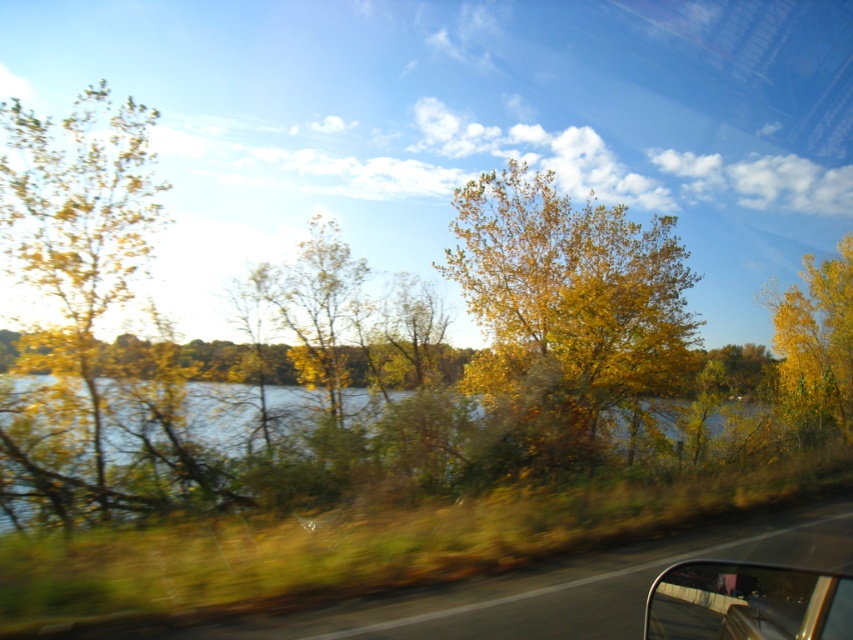
Between yellow/golden leaves at center and transparent glass car window at lower right, which one has more height?

yellow/golden leaves at center

Is yellow/golden leaves at center bigger than transparent glass car window at lower right?

Indeed, yellow/golden leaves at center has a larger size compared to transparent glass car window at lower right.

Is point (560, 317) farther from viewer compared to point (657, 577)?

Yes, it is behind point (657, 577).

The image size is (853, 640). Find the location of `yellow/golden leaves at center`. yellow/golden leaves at center is located at coordinates (566, 314).

Which is more to the right, yellow-green leaves at left or yellow leafy tree at right?

yellow leafy tree at right is more to the right.

Is yellow-green leaves at left wider than yellow leafy tree at right?

Indeed, yellow-green leaves at left has a greater width compared to yellow leafy tree at right.

Who is more distant from viewer, (80, 468) or (788, 404)?

The point (788, 404) is more distant.

Locate an element on the screen. Image resolution: width=853 pixels, height=640 pixels. yellow-green leaves at left is located at coordinates (70, 292).

Identify the location of transparent glass car window at lower right. This screenshot has height=640, width=853. click(747, 602).

Identify the location of transparent glass car window at lower right. (747, 602).